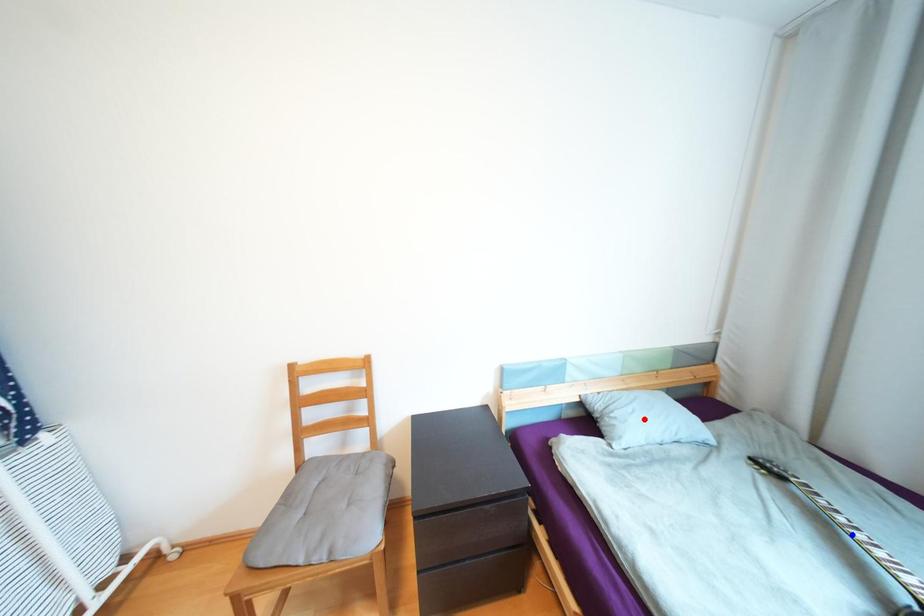
Question: Which of the two points in the image is closer to the camera?

Choices:
 (A) Blue point is closer.
 (B) Red point is closer.

Answer: (A)